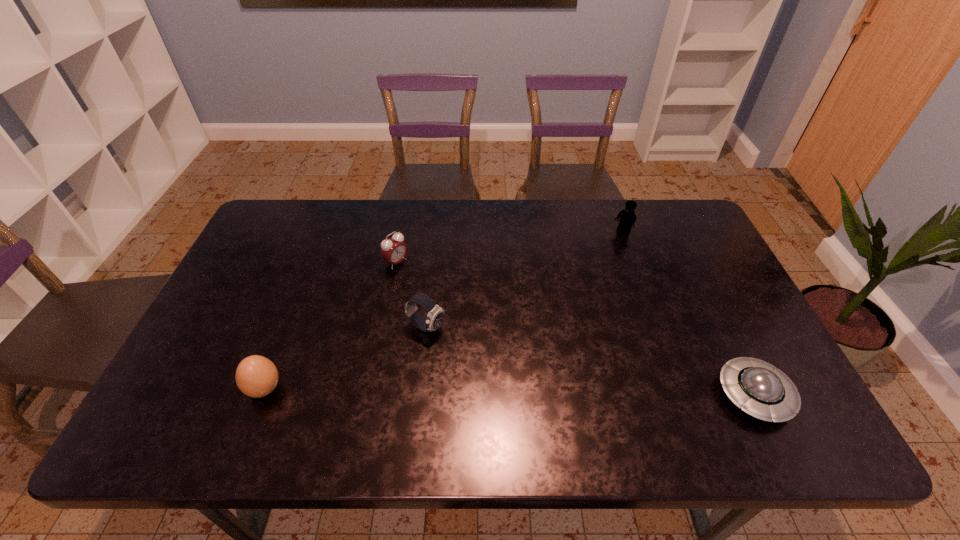
Identify the location of vacant spot on the desktop that is between the boiled egg and the shortest object and is positioned on the face of the third nearest object. The width and height of the screenshot is (960, 540). pos(545,392).

This screenshot has height=540, width=960. What are the coordinates of `vacant spot on the desktop that is between the leftmost object and the shortest object and is positioned on the front-facing side of the Lego` in the screenshot? It's located at (494, 392).

Where is `free spot on the desktop that is between the leftmost object and the shortest object and is positioned on the clock face of the second object from left to right`? The image size is (960, 540). free spot on the desktop that is between the leftmost object and the shortest object and is positioned on the clock face of the second object from left to right is located at coordinates (581, 393).